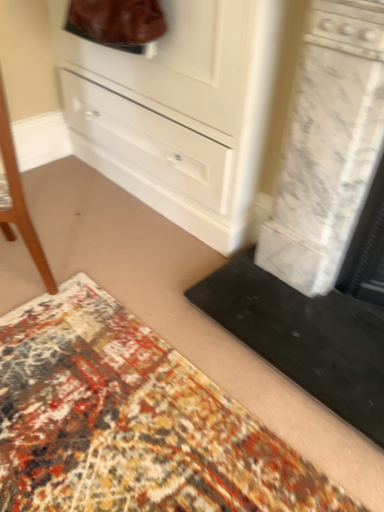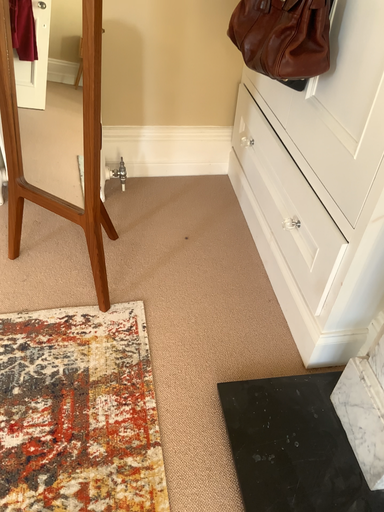
Question: How did the camera likely rotate when shooting the video?

Choices:
 (A) rotated right
 (B) rotated left

Answer: (B)